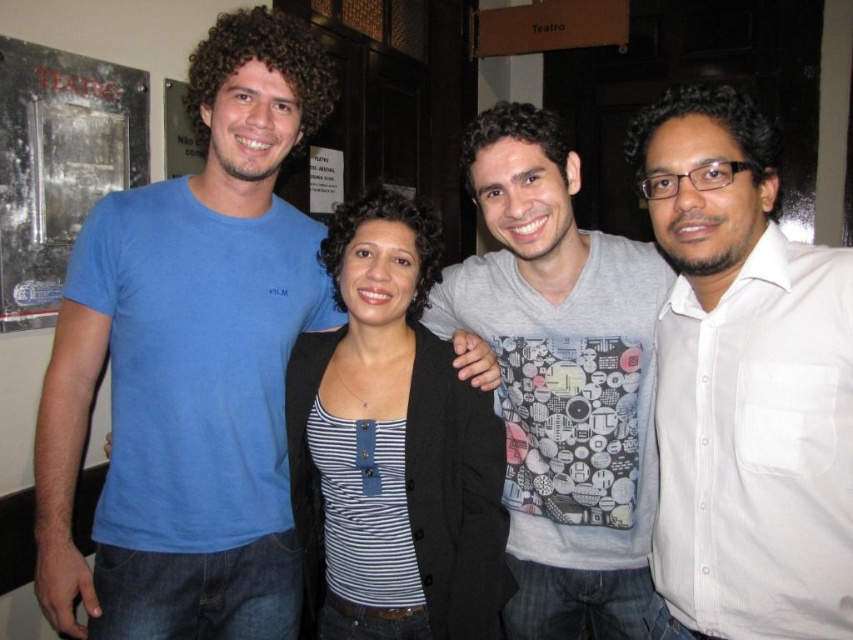
Question: Can you confirm if matte blue t-shirt at left is bigger than gray printed t-shirt at center?

Choices:
 (A) no
 (B) yes

Answer: (B)

Question: Which is nearer to the gray printed t-shirt at center?

Choices:
 (A) matte blue t-shirt at left
 (B) striped fabric top at center
 (C) white shirt at right

Answer: (B)

Question: Is matte blue t-shirt at left above gray printed t-shirt at center?

Choices:
 (A) yes
 (B) no

Answer: (A)

Question: Which is farther from the white shirt at right?

Choices:
 (A) gray printed t-shirt at center
 (B) striped fabric top at center

Answer: (B)

Question: Does white shirt at right have a greater width compared to gray printed t-shirt at center?

Choices:
 (A) no
 (B) yes

Answer: (A)

Question: Which of the following is the farthest from the observer?

Choices:
 (A) (434, 490)
 (B) (605, 244)
 (C) (91, 632)
 (D) (827, 256)

Answer: (B)